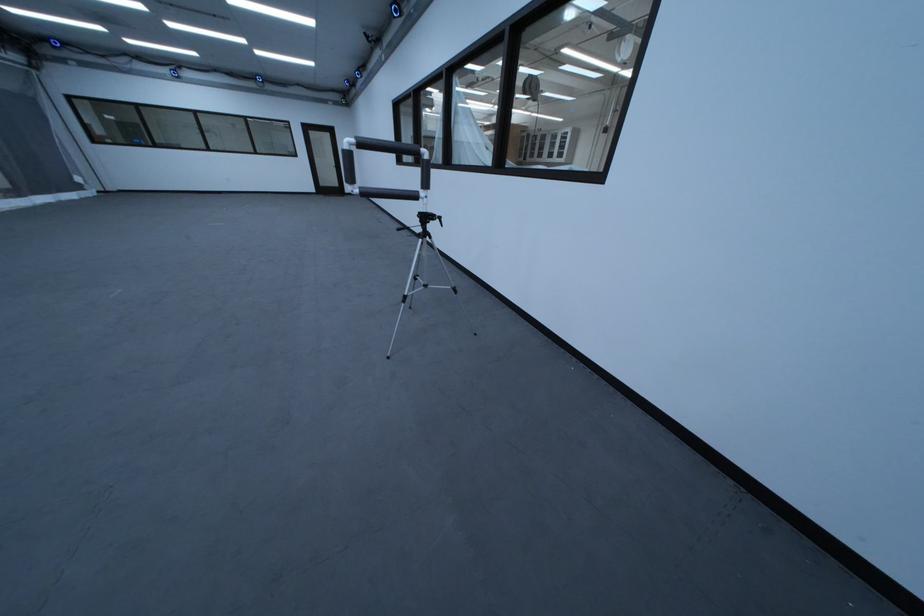
The height and width of the screenshot is (616, 924). Find the location of `tripod pan handle`. tripod pan handle is located at coordinates (421, 224).